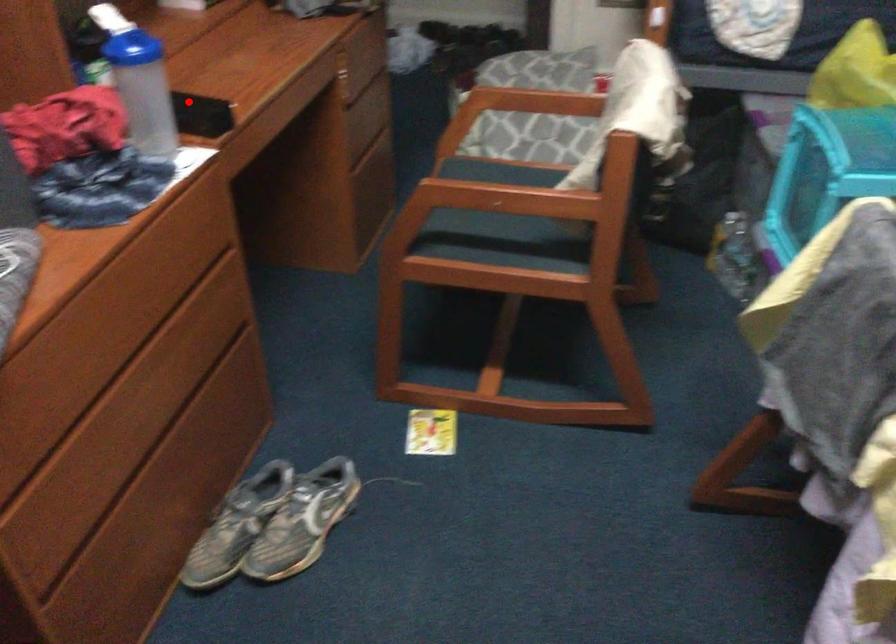
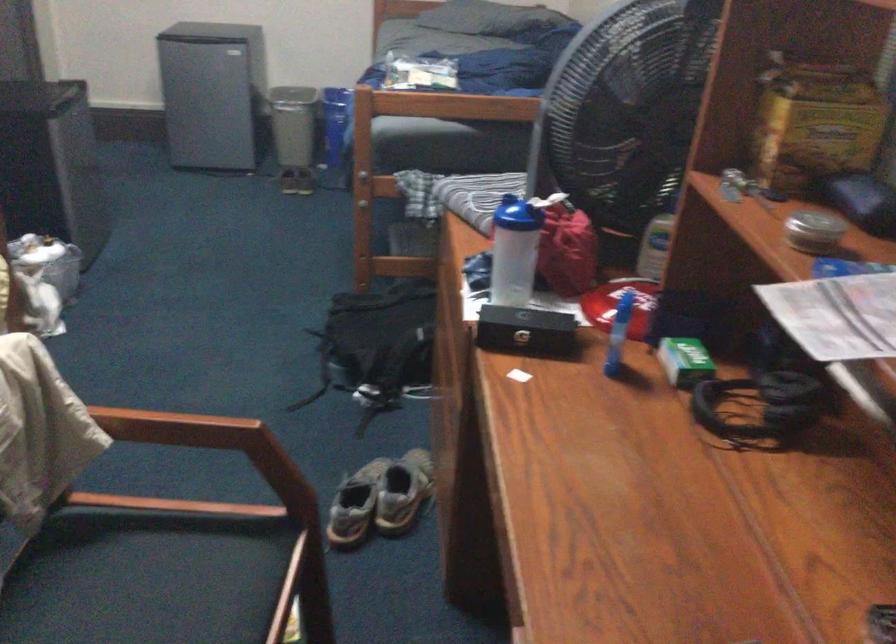
Question: I am providing you with two images of the same scene from different viewpoints. Given a red point in image1, look at the same physical point in image2. Is it:

Choices:
 (A) Closer to the viewpoint
 (B) Farther from the viewpoint

Answer: (A)